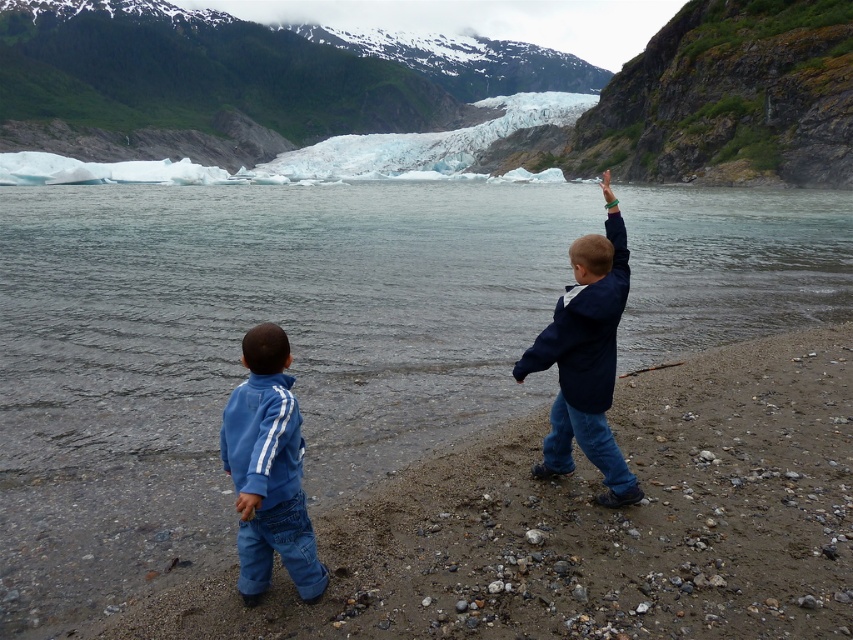
You are a photographer trying to capture a photo of both the blue fleece jacket at lower left and the navy blue jacket at right. Since you want them both in the frame, which jacket should you position closer to the center of the photo to ensure both are visible?

To ensure both the blue fleece jacket at lower left and the navy blue jacket at right are visible in the photo, position the navy blue jacket at right closer to the center. Since the blue fleece jacket at lower left is already on the left side of the navy blue jacket at right, centering the navy blue jacket would help balance both subjects within the frame.

You are standing on the smooth sand beach at lower center and want to throw a stone to the navy blue jacket at right. In which direction should you throw the stone?

You should throw the stone to the right because the smooth sand beach at lower center is to the left of the navy blue jacket at right.